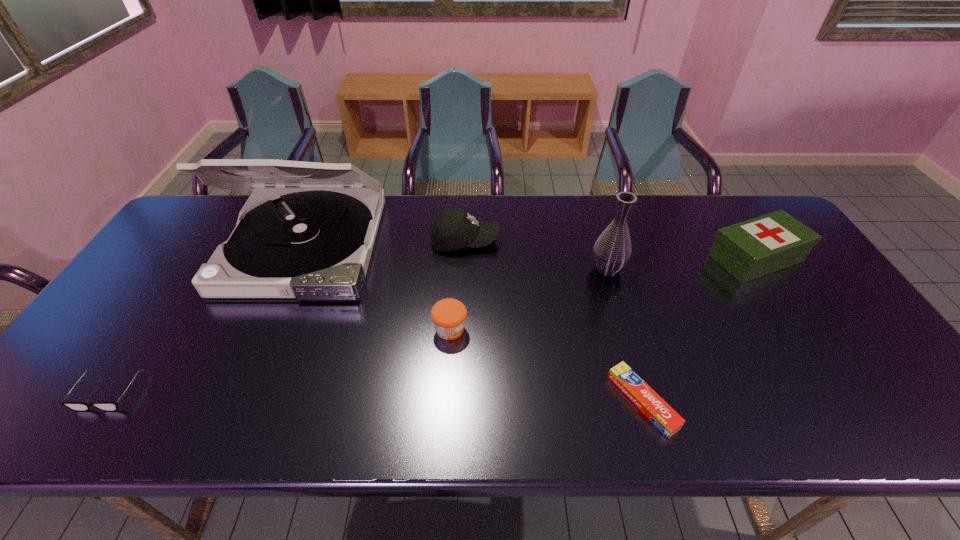
The image size is (960, 540). I want to click on free space between the baseball cap and the toothpaste, so click(x=554, y=321).

This screenshot has width=960, height=540. Find the location of `unoccupied area between the vase and the sixth object from right to left`. unoccupied area between the vase and the sixth object from right to left is located at coordinates (456, 258).

The height and width of the screenshot is (540, 960). I want to click on free area in between the rightmost object and the leftmost object, so tap(432, 325).

Where is `free point between the toothpaste and the jam`? The height and width of the screenshot is (540, 960). free point between the toothpaste and the jam is located at coordinates (546, 365).

At what (x,y) coordinates should I click in order to perform the action: click on empty space that is in between the toothpaste and the fifth tallest object. Please return your answer as a coordinate pair (x, y). The height and width of the screenshot is (540, 960). Looking at the image, I should click on (546, 365).

At what (x,y) coordinates should I click in order to perform the action: click on unoccupied area between the jam and the sixth shortest object. Please return your answer as a coordinate pair (x, y). This screenshot has width=960, height=540. Looking at the image, I should click on (529, 299).

Find the location of `free space between the vase and the leftmost object`. free space between the vase and the leftmost object is located at coordinates (358, 330).

The width and height of the screenshot is (960, 540). I want to click on free spot between the first-aid kit and the jam, so click(x=603, y=294).

Find the location of a particular element. The width and height of the screenshot is (960, 540). the fourth closest object to the leftmost object is located at coordinates (660, 413).

Find the location of a particular element. This screenshot has height=540, width=960. the third closest object relative to the spectacles is located at coordinates (452, 229).